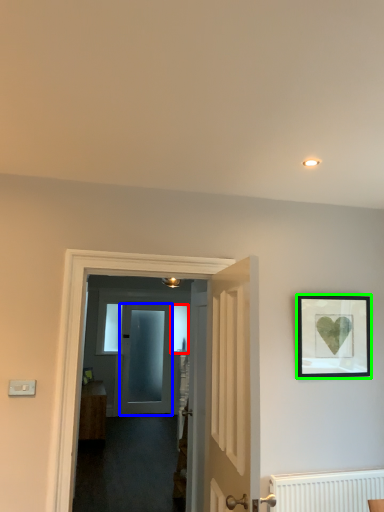
Question: Estimate the real-world distances between objects in this image. Which object is closer to window (highlighted by a red box), door (highlighted by a blue box) or picture frame (highlighted by a green box)?

Choices:
 (A) door
 (B) picture frame

Answer: (A)